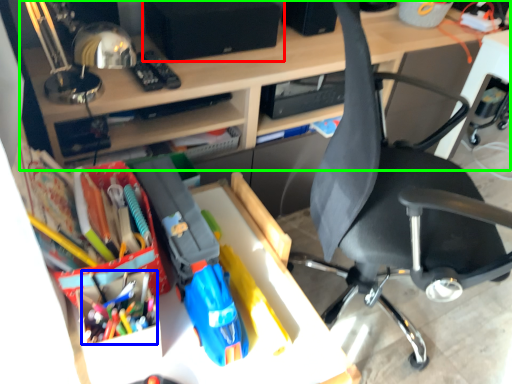
Question: Which object is positioned farthest from speaker (highlighted by a red box)? Select from stationery (highlighted by a blue box) and desk (highlighted by a green box).

Choices:
 (A) stationery
 (B) desk

Answer: (A)